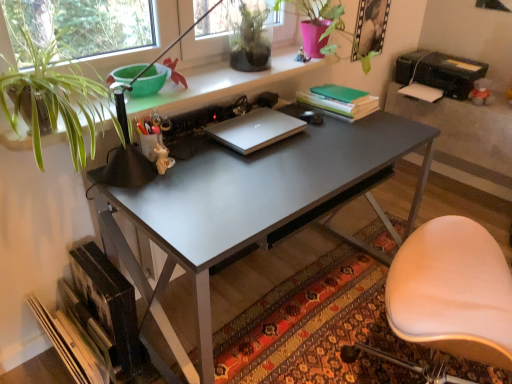
Image resolution: width=512 pixels, height=384 pixels. Describe the element at coordinates (250, 40) in the screenshot. I see `green matte plant at upper center, which appears as the 2th houseplant when ordered from the bottom` at that location.

At what (x,y) coordinates should I click in order to perform the action: click on green matte plant at upper center, which appears as the 2th houseplant when ordered from the bottom. Please return your answer as a coordinate pair (x, y). Image resolution: width=512 pixels, height=384 pixels. Looking at the image, I should click on (250, 40).

You are a GUI agent. You are given a task and a screenshot of the screen. Output one action in this format:
    pyautogui.click(x=<x>, y=<y>)
    Task: Click on the black plastic printer at upper right
    
    Given the screenshot: What is the action you would take?
    pyautogui.click(x=440, y=72)

Describe the element at coordinates (163, 159) in the screenshot. I see `matte white figurine at center` at that location.

Measure the distance between point [494,350] and camera.

A distance of 38.98 inches exists between point [494,350] and camera.

The image size is (512, 384). What do you see at coordinates (94, 320) in the screenshot?
I see `hardcover books at lower left, arranged as the first book when viewed from the front` at bounding box center [94, 320].

Identify the location of green matte book at upper right, acting as the second book starting from the left. Image resolution: width=512 pixels, height=384 pixels. (339, 101).

Considering the points (249, 125) and (253, 326), which point is behind, point (249, 125) or point (253, 326)?

Point (253, 326)

This screenshot has width=512, height=384. I want to click on laptop that is above the carpeted rug at lower center (from a real-world perspective), so click(x=255, y=130).

Between silver metallic laptop at center and carpeted rug at lower center, which one appears on the right side from the viewer's perspective?

Positioned to the right is carpeted rug at lower center.

Looking at this image, looking at their sizes, would you say silver metallic laptop at center is wider or thinner than carpeted rug at lower center?

silver metallic laptop at center is thinner than carpeted rug at lower center.

Locate an element on the screen. toy located above the hardcover books at lower left, which is the second book in top-to-bottom order (from the image's perspective) is located at coordinates (163, 159).

Is matte white figurine at center a part of hardcover books at lower left, the 1th book when ordered from left to right?

No, matte white figurine at center is located outside of hardcover books at lower left, the 1th book when ordered from left to right.

Considering the positions of point (74, 253) and point (167, 161), is point (74, 253) closer or farther from the camera than point (167, 161)?

Point (74, 253) is positioned farther from the camera compared to point (167, 161).

Which object is closer to the camera taking this photo, hardcover books at lower left, which is counted as the 1th book, starting from the bottom, or matte white figurine at center?

hardcover books at lower left, which is counted as the 1th book, starting from the bottom.

From the image's perspective, which is below, white leather chair at lower right or carpeted rug at lower center?

carpeted rug at lower center is shown below in the image.

This screenshot has height=384, width=512. I want to click on chair that is in front of the carpeted rug at lower center, so click(452, 292).

Is white leather chair at lower right oriented towards carpeted rug at lower center?

No, white leather chair at lower right is not aimed at carpeted rug at lower center.

Is white leather chair at lower right to the left or to the right of carpeted rug at lower center in the image?

white leather chair at lower right is positioned on carpeted rug at lower center's right side.

Looking at the image, does hardcover books at lower left, which is counted as the 1th book, starting from the bottom, seem bigger or smaller compared to green matte book at upper right, the 2th book positioned from the bottom?

Considering their sizes, hardcover books at lower left, which is counted as the 1th book, starting from the bottom, takes up more space than green matte book at upper right, the 2th book positioned from the bottom.

Can we say hardcover books at lower left, which is the second book in top-to-bottom order, lies outside green matte book at upper right, placed as the first book when sorted from back to front?

Yes, hardcover books at lower left, which is the second book in top-to-bottom order, is located beyond the bounds of green matte book at upper right, placed as the first book when sorted from back to front.

Where is `book above the hardcover books at lower left, the 2th book in the right-to-left sequence (from the image's perspective)`? Image resolution: width=512 pixels, height=384 pixels. book above the hardcover books at lower left, the 2th book in the right-to-left sequence (from the image's perspective) is located at coordinates (339, 101).

From a real-world perspective, is hardcover books at lower left, placed as the 2th book when sorted from back to front, on green matte book at upper right, placed as the first book when sorted from back to front?

No, from a real-world perspective, hardcover books at lower left, placed as the 2th book when sorted from back to front, is not on top of green matte book at upper right, placed as the first book when sorted from back to front.

Can you confirm if green matte book at upper right, placed as the first book when sorted from back to front, is smaller than black plastic printer at upper right?

Yes, green matte book at upper right, placed as the first book when sorted from back to front, is smaller than black plastic printer at upper right.

Between green matte book at upper right, the 2th book viewed from the front, and black plastic printer at upper right, which one has less height?

green matte book at upper right, the 2th book viewed from the front, is shorter.

Looking at this image, which object is thinner, green matte book at upper right, which ranks as the first book in top-to-bottom order, or black plastic printer at upper right?

With smaller width is green matte book at upper right, which ranks as the first book in top-to-bottom order.

Is green matte book at upper right, acting as the second book starting from the left, not near black plastic printer at upper right?

green matte book at upper right, acting as the second book starting from the left, is actually quite close to black plastic printer at upper right.

Consider the image. Is silver metallic laptop at center looking in the opposite direction of matte white figurine at center?

No, silver metallic laptop at center is not facing the opposite direction of matte white figurine at center.

Can you tell me how much silver metallic laptop at center and matte white figurine at center differ in facing direction?

37.6 degrees.

Is silver metallic laptop at center not near matte white figurine at center?

No, there isn't a large distance between silver metallic laptop at center and matte white figurine at center.

Can you confirm if silver metallic laptop at center is bigger than matte white figurine at center?

Correct, silver metallic laptop at center is larger in size than matte white figurine at center.

Is hardcover books at lower left, placed as the 2th book when sorted from back to front, far from silver metallic laptop at center?

That's not correct — hardcover books at lower left, placed as the 2th book when sorted from back to front, is a little close to silver metallic laptop at center.

In the image, is hardcover books at lower left, the 1th book when ordered from left to right, on the left side or the right side of silver metallic laptop at center?

hardcover books at lower left, the 1th book when ordered from left to right, is to the left of silver metallic laptop at center.

At what (x,y) coordinates should I click in order to perform the action: click on book located underneath the silver metallic laptop at center (from a real-world perspective). Please return your answer as a coordinate pair (x, y). This screenshot has width=512, height=384. Looking at the image, I should click on (94, 320).

From a real-world perspective, is hardcover books at lower left, the 2th book in the right-to-left sequence, physically below silver metallic laptop at center?

Yes, from a real-world perspective, hardcover books at lower left, the 2th book in the right-to-left sequence, is beneath silver metallic laptop at center.

Find the location of a particular element. The image size is (512, 384). mat in front of the silver metallic laptop at center is located at coordinates (302, 318).

Identify the location of book on the left of matte white figurine at center. This screenshot has width=512, height=384. (94, 320).

Estimate the real-world distances between objects in this image. Which object is closer to matte white figurine at center, green matte plant at upper center, which appears as the 2th houseplant when ordered from the bottom, or white leather chair at lower right?

The object closer to matte white figurine at center is green matte plant at upper center, which appears as the 2th houseplant when ordered from the bottom.

Based on their spatial positions, is green matte plant at upper center, which ranks as the 1th houseplant in top-to-bottom order, or carpeted rug at lower center closer to black plastic printer at upper right?

Based on the image, carpeted rug at lower center appears to be nearer to black plastic printer at upper right.

Based on their spatial positions, is green matte book at upper right, which ranks as the first book in top-to-bottom order, or green leafy plant at upper left, which appears as the 2th houseplant when viewed from the top, further from white leather chair at lower right?

green leafy plant at upper left, which appears as the 2th houseplant when viewed from the top, is further to white leather chair at lower right.

From the image, which object appears to be farther from matte gray desk at center, green leafy plant at upper left, the 2th houseplant viewed from the right, or white leather chair at lower right?

Among the two, green leafy plant at upper left, the 2th houseplant viewed from the right, is located further to matte gray desk at center.

When comparing their distances from hardcover books at lower left, arranged as the first book when viewed from the front, does black plastic printer at upper right or green matte plant at upper center, which appears as the 2th houseplant when ordered from the bottom, seem further?

Among the two, black plastic printer at upper right is located further to hardcover books at lower left, arranged as the first book when viewed from the front.

Looking at the image, which one is located further to matte white figurine at center, green leafy plant at upper left, the 2th houseplant viewed from the right, or green matte plant at upper center, which appears as the second houseplant when viewed from the left?

green matte plant at upper center, which appears as the second houseplant when viewed from the left, is further to matte white figurine at center.

Looking at the image, which one is located further to matte white figurine at center, black plastic printer at upper right or carpeted rug at lower center?

Among the two, black plastic printer at upper right is located further to matte white figurine at center.

When comparing their distances from green matte plant at upper center, which appears as the second houseplant when viewed from the left, does black plastic printer at upper right or green matte book at upper right, which is the first book from right to left, seem further?

Among the two, black plastic printer at upper right is located further to green matte plant at upper center, which appears as the second houseplant when viewed from the left.

In order to click on houseplant situated between matte white figurine at center and black plastic printer at upper right from left to right in this screenshot , I will do `click(250, 40)`.

At what (x,y) coordinates should I click in order to perform the action: click on desk located between white leather chair at lower right and black plastic printer at upper right in the depth direction. Please return your answer as a coordinate pair (x, y). The image size is (512, 384). Looking at the image, I should click on (253, 205).

The height and width of the screenshot is (384, 512). In order to click on laptop between green matte plant at upper center, which appears as the second houseplant when viewed from the left, and carpeted rug at lower center, in the vertical direction in this screenshot , I will do `click(255, 130)`.

Identify the location of desk located between hardcover books at lower left, which is counted as the 1th book, starting from the bottom, and green matte book at upper right, placed as the first book when sorted from back to front, in the left-right direction. This screenshot has width=512, height=384. (253, 205).